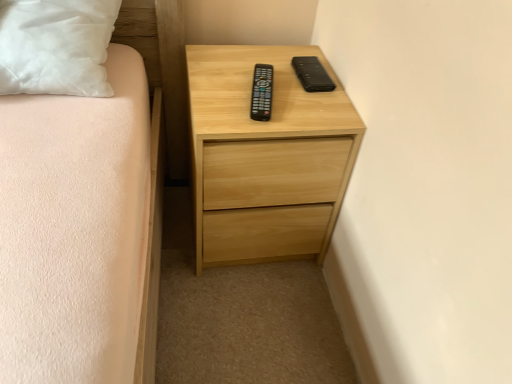
Identify the location of empty space that is ontop of natural wood chest of drawers at center (from a real-world perspective). (250, 81).